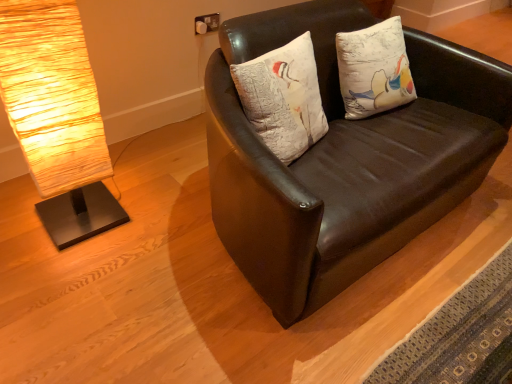
Question: Considering the relative sizes of rustic wood lamp at left and white textured pillow at center in the image provided, is rustic wood lamp at left shorter than white textured pillow at center?

Choices:
 (A) no
 (B) yes

Answer: (A)

Question: Considering the relative sizes of rustic wood lamp at left and white textured pillow at center in the image provided, is rustic wood lamp at left wider than white textured pillow at center?

Choices:
 (A) no
 (B) yes

Answer: (B)

Question: From the image's perspective, is rustic wood lamp at left beneath white textured pillow at center?

Choices:
 (A) yes
 (B) no

Answer: (A)

Question: Considering the relative positions of rustic wood lamp at left and white textured pillow at center in the image provided, is rustic wood lamp at left to the left of white textured pillow at center from the viewer's perspective?

Choices:
 (A) yes
 (B) no

Answer: (A)

Question: Would you say white textured pillow at center is part of rustic wood lamp at left's contents?

Choices:
 (A) no
 (B) yes

Answer: (A)

Question: From a real-world perspective, is white textured pillow at center positioned above or below matte brown leather couch at center?

Choices:
 (A) above
 (B) below

Answer: (A)

Question: Based on their sizes in the image, would you say white textured pillow at center is bigger or smaller than matte brown leather couch at center?

Choices:
 (A) big
 (B) small

Answer: (B)

Question: Considering the relative positions of white textured pillow at center and matte brown leather couch at center in the image provided, is white textured pillow at center to the left or to the right of matte brown leather couch at center?

Choices:
 (A) right
 (B) left

Answer: (B)

Question: From the image's perspective, is white textured pillow at center located above or below matte brown leather couch at center?

Choices:
 (A) below
 (B) above

Answer: (B)

Question: Is point (226, 238) positioned closer to the camera than point (305, 109)?

Choices:
 (A) farther
 (B) closer

Answer: (B)

Question: From the image's perspective, is matte brown leather couch at center above or below white textured pillow at center?

Choices:
 (A) below
 (B) above

Answer: (A)

Question: Would you say matte brown leather couch at center is inside or outside white textured pillow at center?

Choices:
 (A) inside
 (B) outside

Answer: (B)

Question: Based on their positions, is matte brown leather couch at center located to the left or right of white textured pillow at center?

Choices:
 (A) right
 (B) left

Answer: (A)

Question: Do you think white textured pillow at center is within rustic wood lamp at left, or outside of it?

Choices:
 (A) outside
 (B) inside

Answer: (A)

Question: Considering the positions of point (315, 74) and point (5, 109), is point (315, 74) closer or farther from the camera than point (5, 109)?

Choices:
 (A) farther
 (B) closer

Answer: (A)